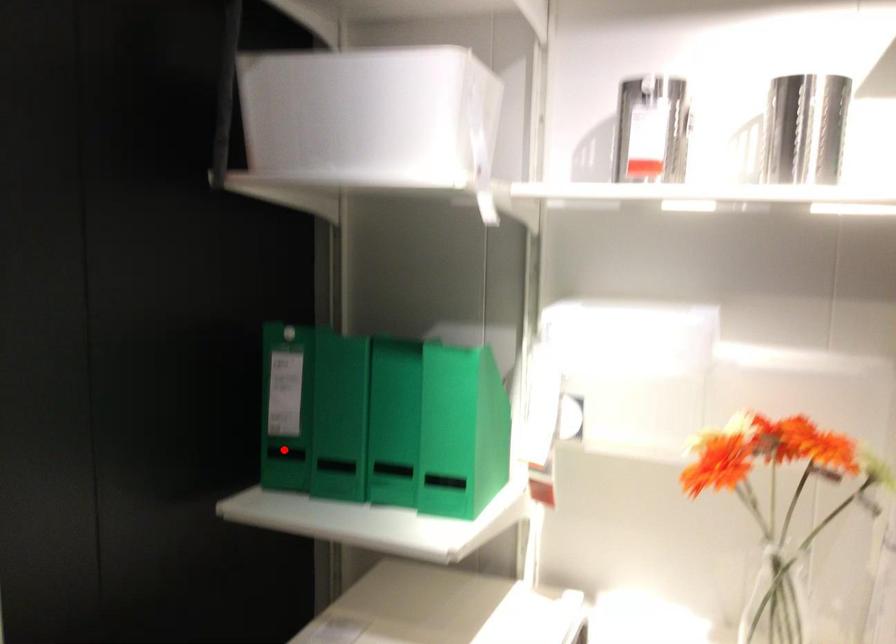
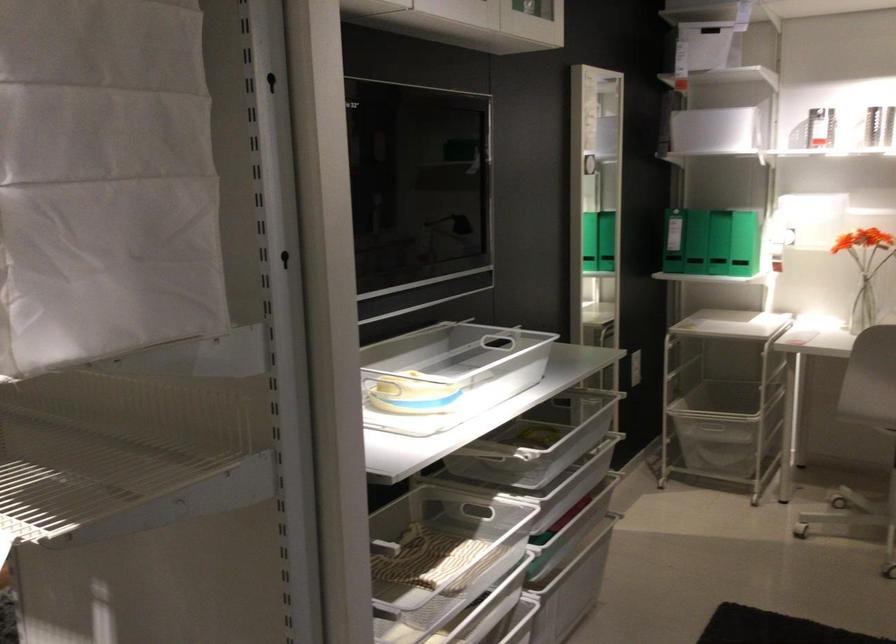
Question: A red point is marked in image1. In image2, is the corresponding 3D point closer to the camera or farther? Reply with the corresponding letter.

Choices:
 (A) The corresponding 3D point is closer.
 (B) The corresponding 3D point is farther.

Answer: (B)